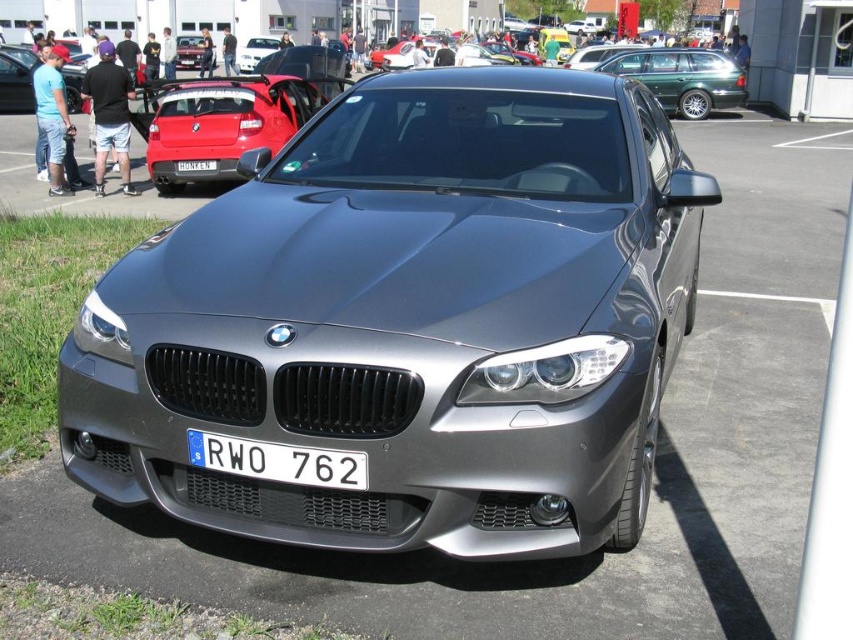
Question: Observing the image, what is the correct spatial positioning of metallic green wagon at upper right in reference to white plastic license plate at center?

Choices:
 (A) below
 (B) above

Answer: (B)

Question: Can you confirm if matte black sedan at upper left is positioned to the left of matte black car at upper left?

Choices:
 (A) yes
 (B) no

Answer: (B)

Question: Among these points, which one is nearest to the camera?

Choices:
 (A) (207, 163)
 (B) (260, 474)
 (C) (192, 60)
 (D) (698, 115)

Answer: (B)

Question: Which point is farther to the camera?

Choices:
 (A) (569, 60)
 (B) (212, 166)
 (C) (199, 442)

Answer: (A)

Question: Does metallic green wagon at upper right appear on the right side of matte black car at upper center?

Choices:
 (A) yes
 (B) no

Answer: (A)

Question: Which point appears farthest from the camera in this image?

Choices:
 (A) (688, 81)
 (B) (207, 161)
 (C) (219, 129)
 (D) (194, 36)

Answer: (D)